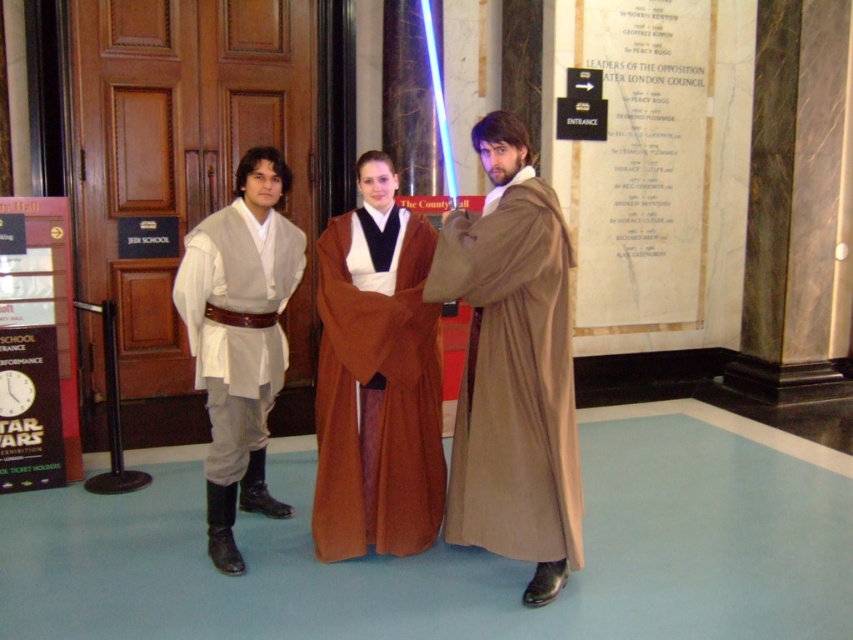
You are a costume designer who needs to adjust the height of the brown woolen robe at center and the white matte robe at left to ensure they are the same height. Which robe requires shortening?

The brown woolen robe at center is taller than the white matte robe at left, so the brown woolen robe at center needs to be shortened to match the height of the white matte robe at left.

You are a photographer at the Jedi School event and need to capture a photo where both the brown satin robe at center and the white matte robe at left are clearly visible. Based on their positions, which robe should you focus on first to ensure both are in frame?

The brown satin robe at center is in front of the white matte robe at left, so focus on the white matte robe at left first to ensure both are visible in the photo.

You are a photographer positioned at the entrance of the Jedi School. You need to capture a photo of the brown woolen robe at center and the brown satin robe at center. The camera can only focus on objects within a 12 inch range. Can both robes be in focus at the same time?

The distance between the brown woolen robe at center and the brown satin robe at center is 13.22 inches, which exceeds the camera focus range of 12 inches. Therefore, both robes cannot be in focus simultaneously.